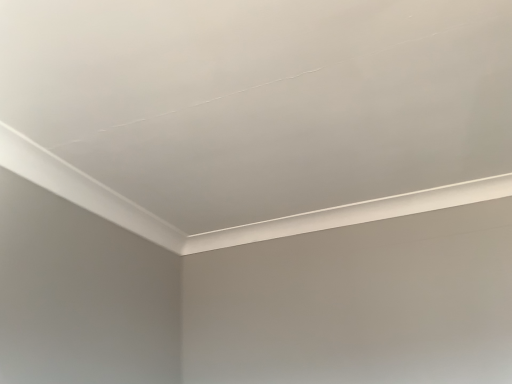
Find the location of `white matte ceiling at upper center`. white matte ceiling at upper center is located at coordinates (265, 103).

What is the approximate height of white matte ceiling at upper center?

white matte ceiling at upper center is 1.37 inches tall.

Image resolution: width=512 pixels, height=384 pixels. What do you see at coordinates (265, 103) in the screenshot?
I see `white matte ceiling at upper center` at bounding box center [265, 103].

Find the location of `white matte ceiling at upper center`. white matte ceiling at upper center is located at coordinates [265, 103].